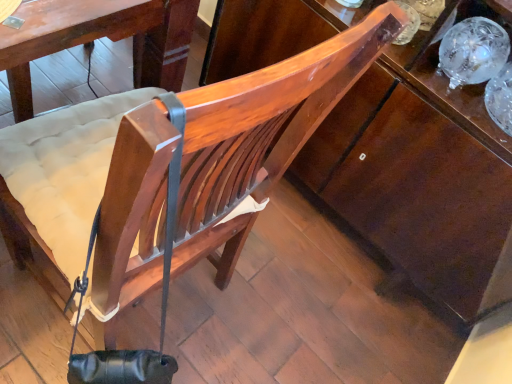
What is the approximate width of wooden chair at center?

wooden chair at center is 23.81 inches in width.

The height and width of the screenshot is (384, 512). What do you see at coordinates (261, 134) in the screenshot? I see `wooden chair at center` at bounding box center [261, 134].

Measure the distance between wooden chair at center and camera.

wooden chair at center and camera are 33.16 centimeters apart from each other.

Locate an element on the screen. This screenshot has width=512, height=384. wooden chair at center is located at coordinates (261, 134).

Locate an element on the screen. Image resolution: width=512 pixels, height=384 pixels. wooden chair at center is located at coordinates (261, 134).